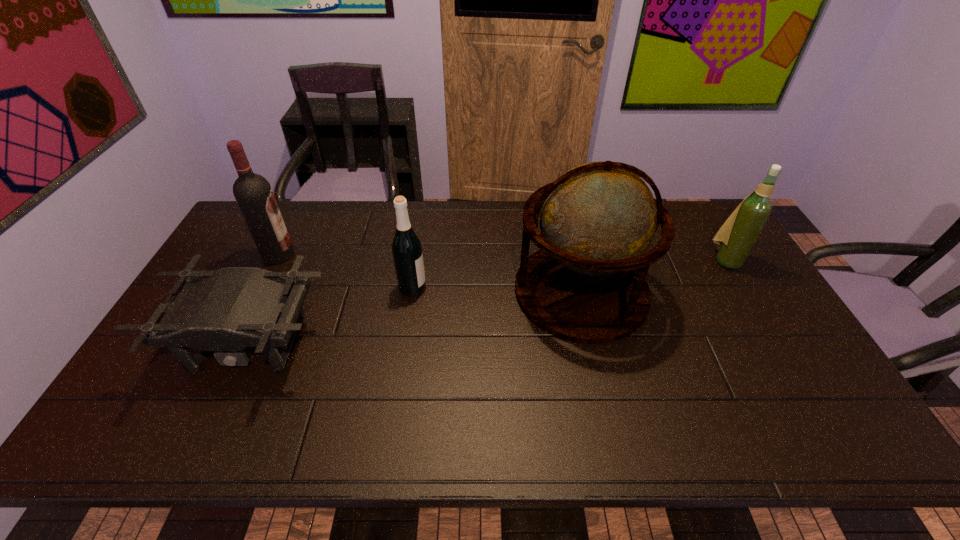
Find the location of a particular element. Image resolution: width=960 pixels, height=540 pixels. vacant region at the far right corner of the desktop is located at coordinates (719, 224).

The height and width of the screenshot is (540, 960). In order to click on free space between the leftmost wine bottle and the rightmost object in this screenshot , I will do `click(502, 258)`.

Locate an element on the screen. The image size is (960, 540). free spot between the rightmost wine bottle and the drone is located at coordinates (488, 302).

Locate an element on the screen. free space between the leftmost wine bottle and the nearest wine bottle is located at coordinates (346, 271).

Identify the location of free space that is in between the nearest wine bottle and the leftmost wine bottle. The height and width of the screenshot is (540, 960). (346, 271).

Identify the location of vacant region between the leftmost wine bottle and the nearest wine bottle. (346, 271).

This screenshot has width=960, height=540. What are the coordinates of `free point between the globe and the nearest wine bottle` in the screenshot? It's located at (496, 289).

Where is `free space between the leftmost wine bottle and the fourth object from left to right`? The width and height of the screenshot is (960, 540). free space between the leftmost wine bottle and the fourth object from left to right is located at coordinates (430, 273).

The width and height of the screenshot is (960, 540). I want to click on free area in between the rightmost wine bottle and the fourth object from left to right, so click(x=653, y=276).

You are a GUI agent. You are given a task and a screenshot of the screen. Output one action in this format:
    pyautogui.click(x=<x>, y=<y>)
    Task: Click on the unoccupied area between the rightmost wine bottle and the globe
    The image size is (960, 540).
    Given the screenshot: What is the action you would take?
    pyautogui.click(x=653, y=276)